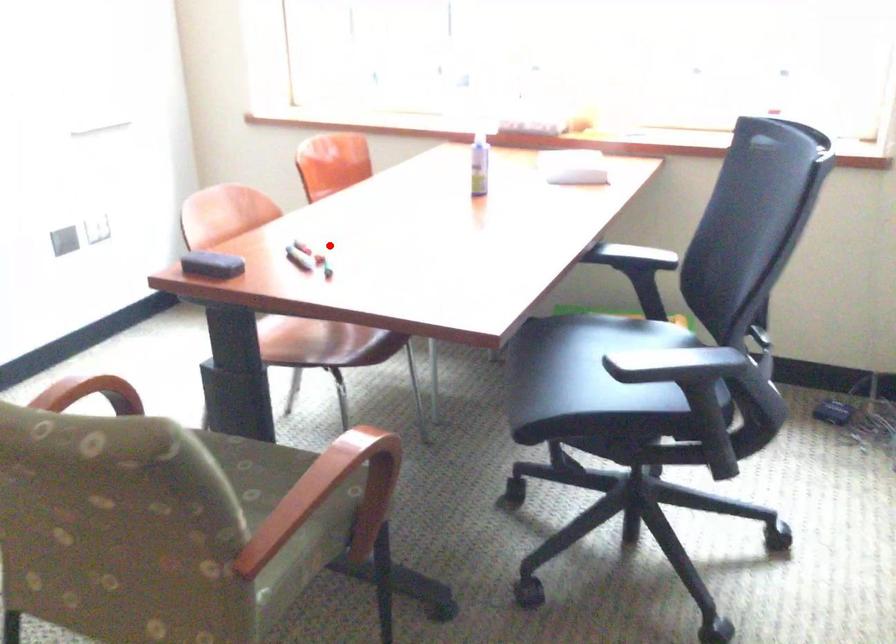
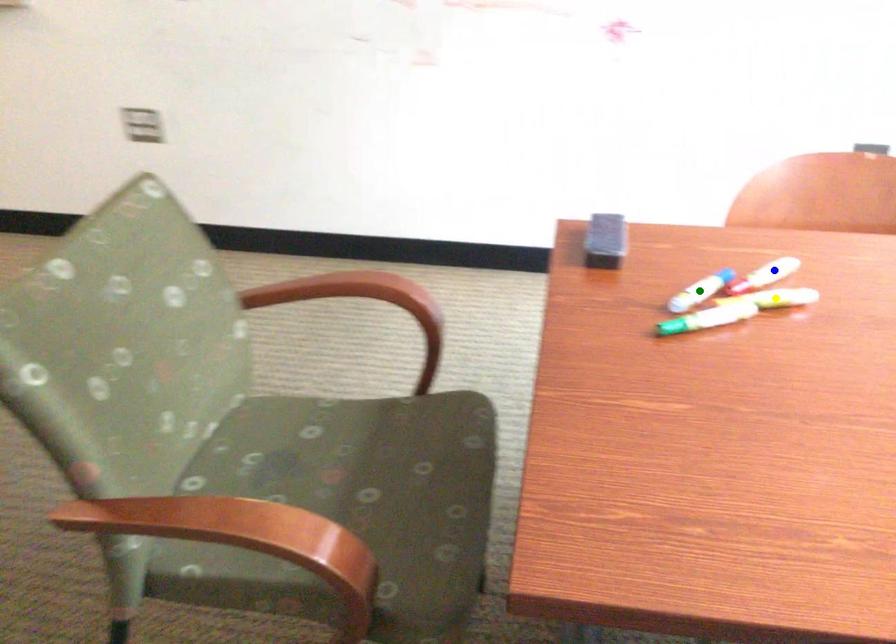
Question: I am providing you with two images of the same scene from different viewpoints. A red point is marked on the first image. You are given multiple points on the second image. Which point in image 2 is actually the same real-world point as the red point in image 1?

Choices:
 (A) green point
 (B) blue point
 (C) yellow point

Answer: (C)